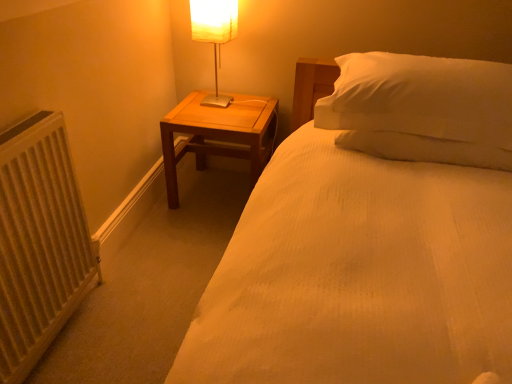
Identify the location of blank space above wooden nightstand at center (from a real-world perspective). (218, 120).